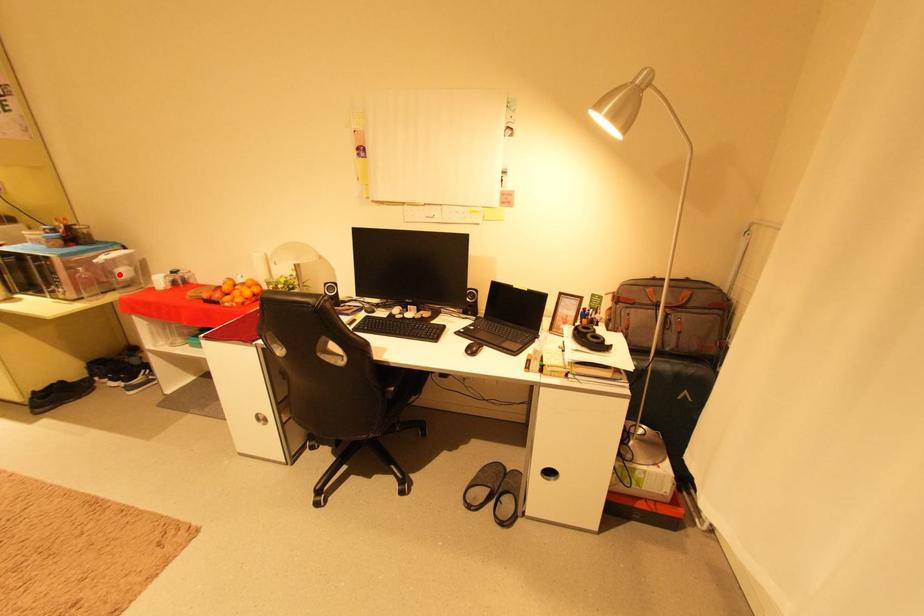
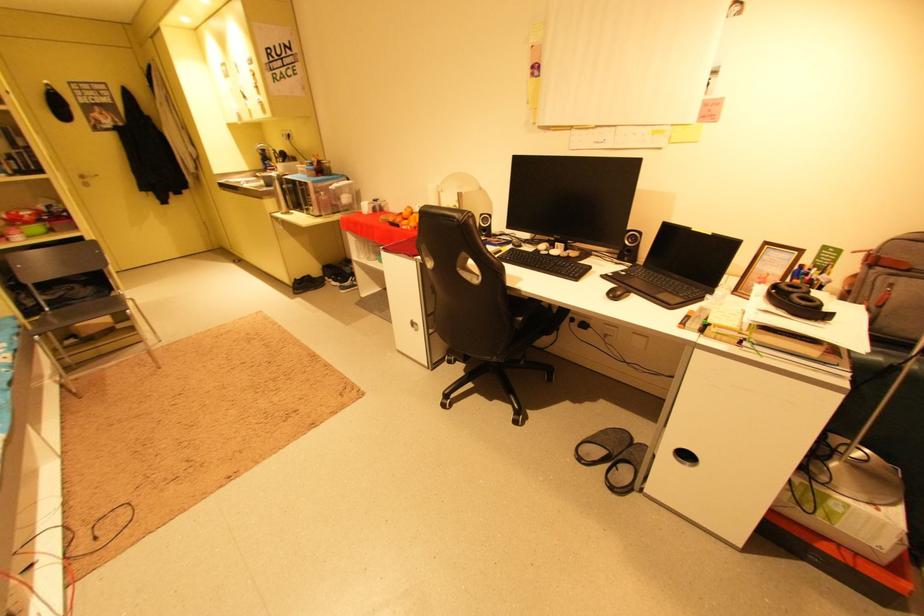
Question: A red point is marked in image1. In image2, is the corresponding 3D point closer to the camera or farther? Reply with the corresponding letter.

Choices:
 (A) The corresponding 3D point is closer.
 (B) The corresponding 3D point is farther.

Answer: (A)